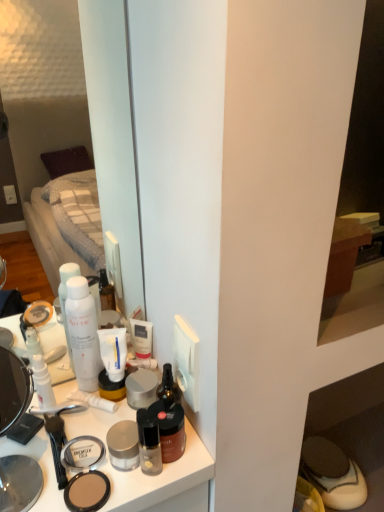
Where is `free spot to the left of translucent glass bottle at center, which ranks as the third toiletry in left-to-right order`? The width and height of the screenshot is (384, 512). free spot to the left of translucent glass bottle at center, which ranks as the third toiletry in left-to-right order is located at coordinates (64, 451).